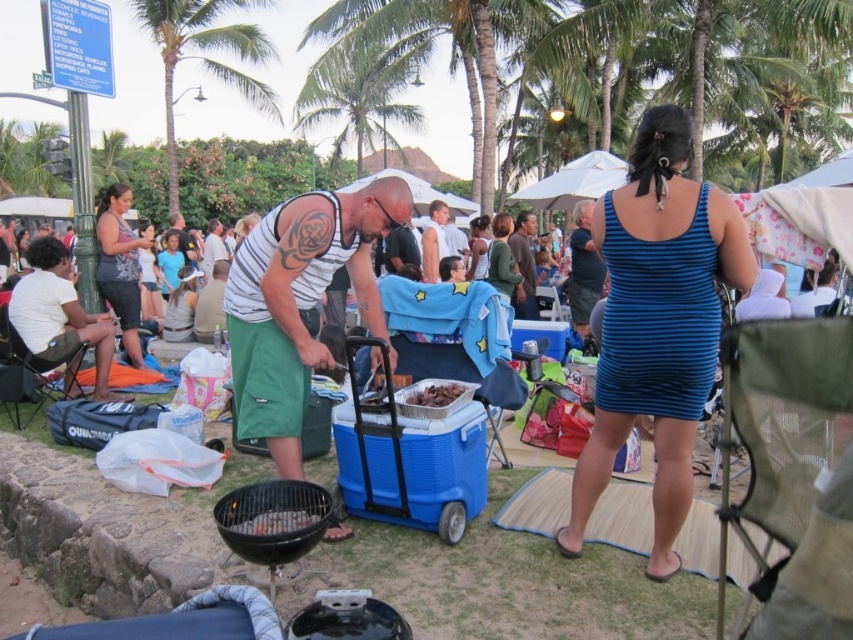
Question: Which of the following is the farthest from the observer?

Choices:
 (A) (277, 524)
 (B) (318, 60)
 (C) (440, 209)
 (D) (521, 221)

Answer: (B)

Question: Is charcoal briquettes at center above green fabric shorts at center?

Choices:
 (A) yes
 (B) no

Answer: (B)

Question: Which point is closer to the camera?

Choices:
 (A) brown cotton shirt at center
 (B) charcoal briquettes at center

Answer: (B)

Question: Does green leafy palm tree at upper center come in front of charcoal briquettes at center?

Choices:
 (A) no
 (B) yes

Answer: (A)

Question: Which point is farther to the camera?

Choices:
 (A) green leafy palm tree at upper left
 (B) charcoal briquettes at center

Answer: (A)

Question: Is the position of green cotton shorts at center less distant than that of charcoal briquettes at center?

Choices:
 (A) yes
 (B) no

Answer: (B)